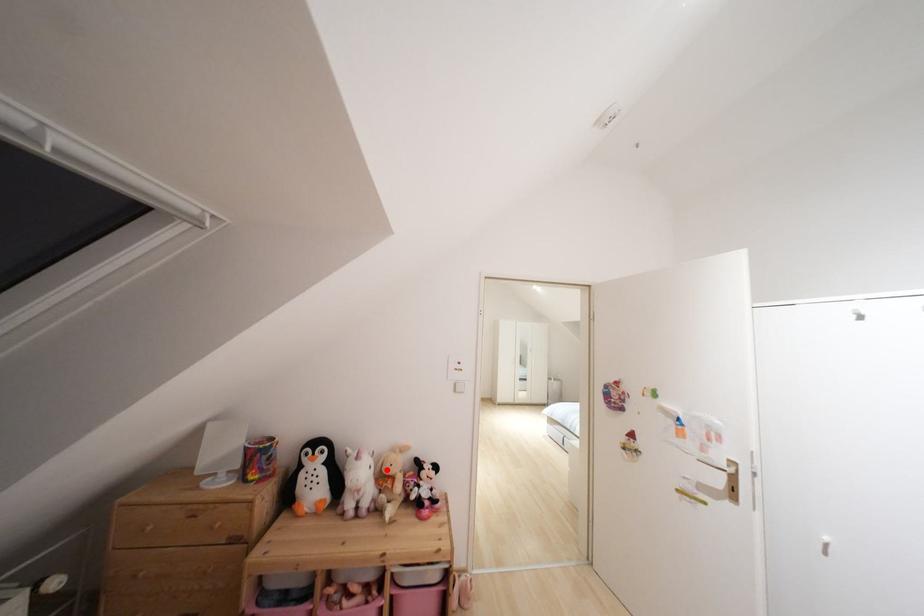
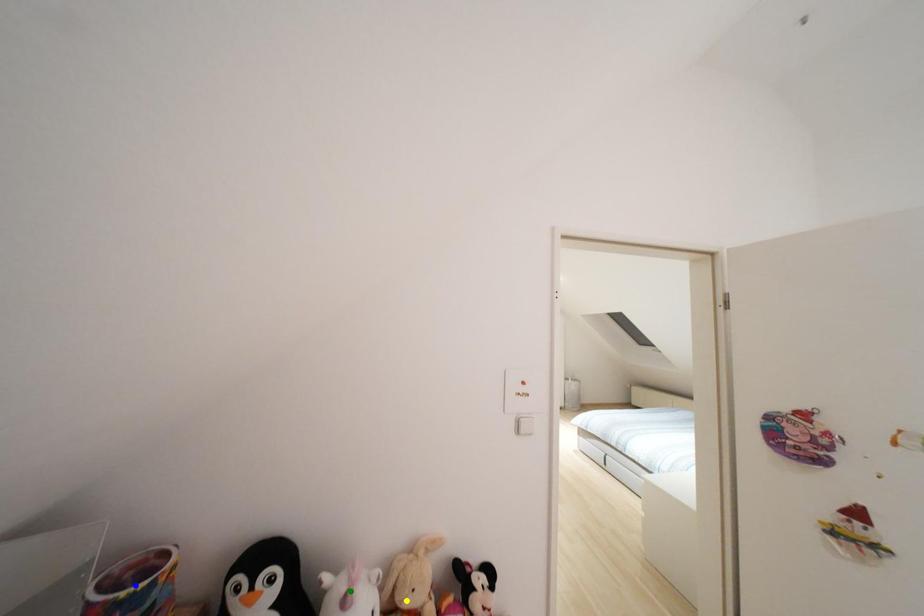
Question: I am providing you with two images of the same scene from different viewpoints. A red point is marked on the first image. You are given multiple points on the second image. Which mark in image 2 goes with the point in image 1?

Choices:
 (A) green point
 (B) blue point
 (C) yellow point

Answer: (C)